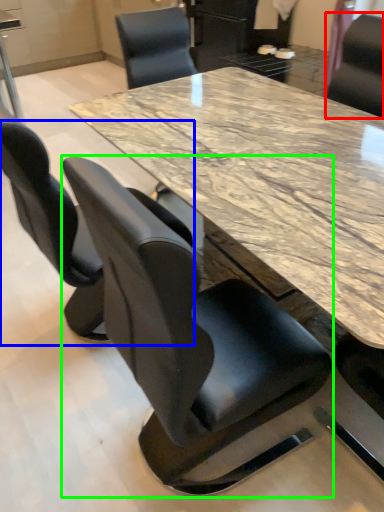
Question: Which is farther away from chair (highlighted by a red box)? chair (highlighted by a blue box) or chair (highlighted by a green box)?

Choices:
 (A) chair
 (B) chair

Answer: (B)